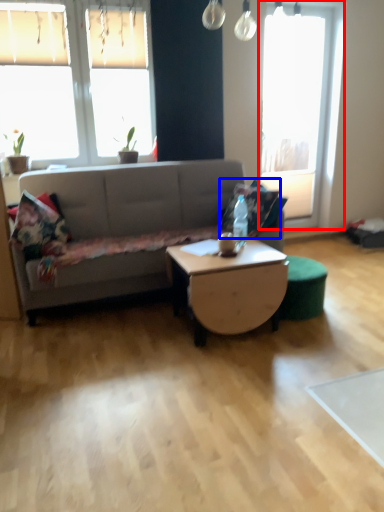
Question: Which of the following is the closest to the observer, window (highlighted by a red box) or pillow (highlighted by a blue box)?

Choices:
 (A) window
 (B) pillow

Answer: (B)